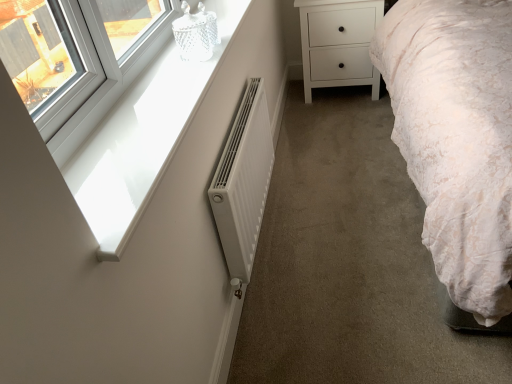
Question: From a real-world perspective, relative to white glossy window sill at upper left, is white matte radiator at center vertically above or below?

Choices:
 (A) below
 (B) above

Answer: (A)

Question: From the image's perspective, relative to white glossy window sill at upper left, is white matte radiator at center above or below?

Choices:
 (A) below
 (B) above

Answer: (A)

Question: Which object is positioned closest to the white matte chest of drawers at center?

Choices:
 (A) white matte radiator at center
 (B) white glossy window sill at upper left
 (C) white glossy window sill at upper left

Answer: (A)

Question: Which of these objects is positioned farthest from the white glossy window sill at upper left?

Choices:
 (A) white matte radiator at center
 (B) white glossy window sill at upper left
 (C) white matte chest of drawers at center

Answer: (C)